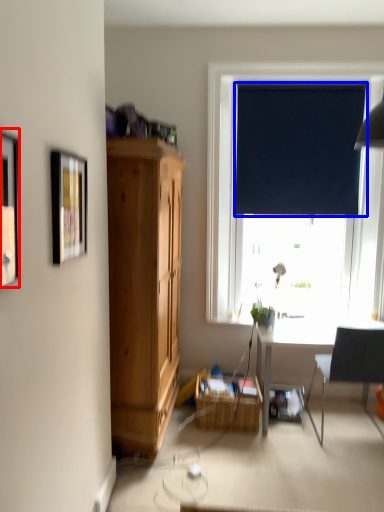
Question: Which point is closer to the camera, picture frame (highlighted by a red box) or curtain (highlighted by a blue box)?

Choices:
 (A) picture frame
 (B) curtain

Answer: (A)